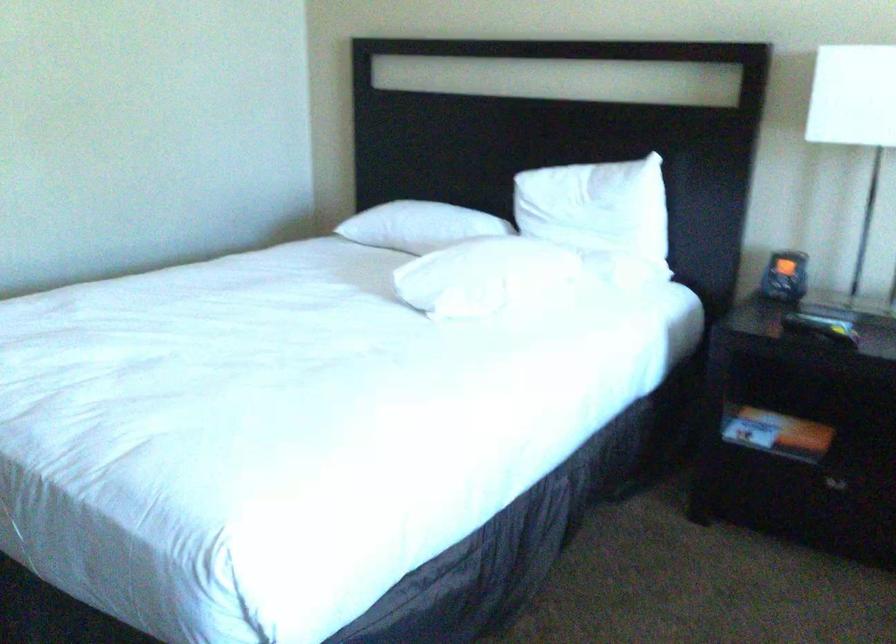
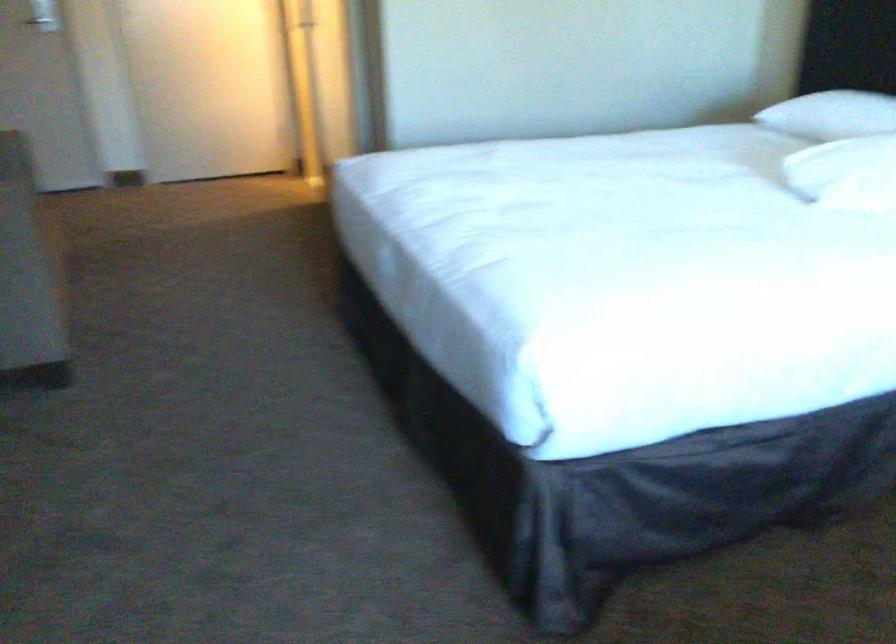
In the second image, find the point that corresponds to pixel 407 232 in the first image.

(831, 115)